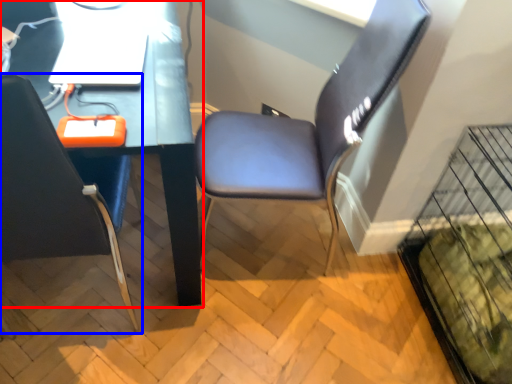
Question: Which object is further to the camera taking this photo, computer desk (highlighted by a red box) or chair (highlighted by a blue box)?

Choices:
 (A) computer desk
 (B) chair

Answer: (A)